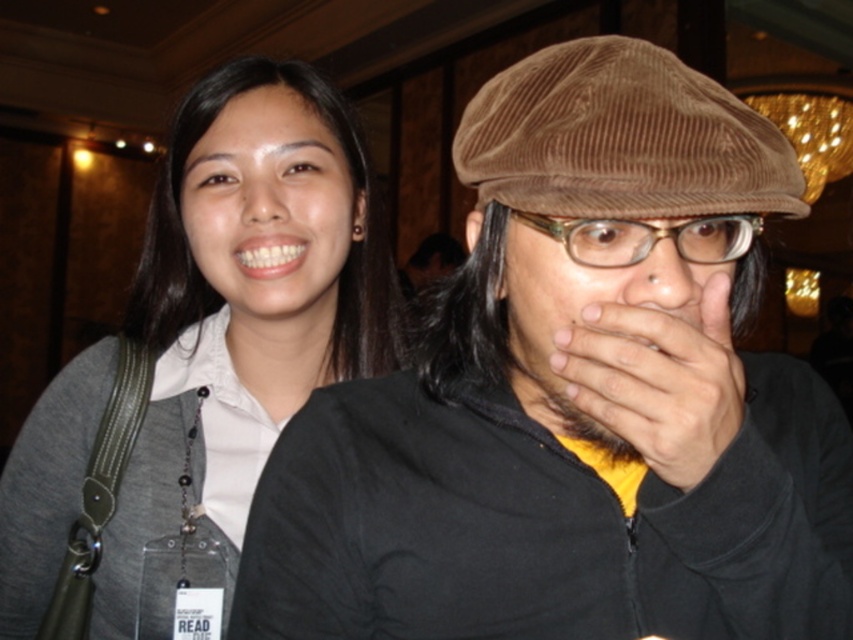
Based on the scene description, where is the brown corduroy cap at upper center located in the image?

The brown corduroy cap at upper center is located at the 2D coordinates point (573, 403).